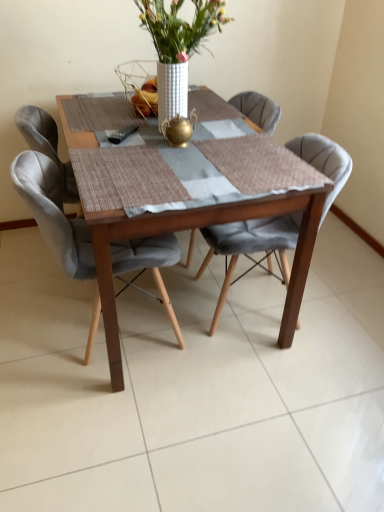
In order to click on vacant space that is to the left of white textured vase at center in this screenshot , I will do `click(96, 124)`.